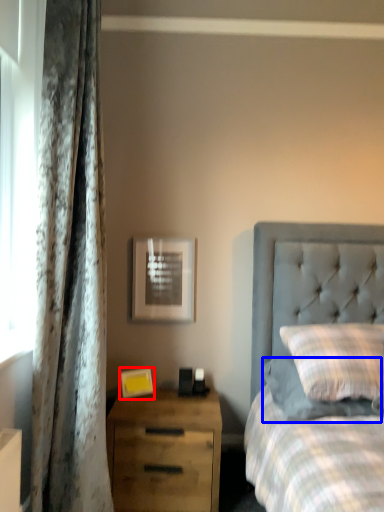
Question: Which of the following is the farthest to the observer, picture frame (highlighted by a red box) or pillow (highlighted by a blue box)?

Choices:
 (A) picture frame
 (B) pillow

Answer: (A)